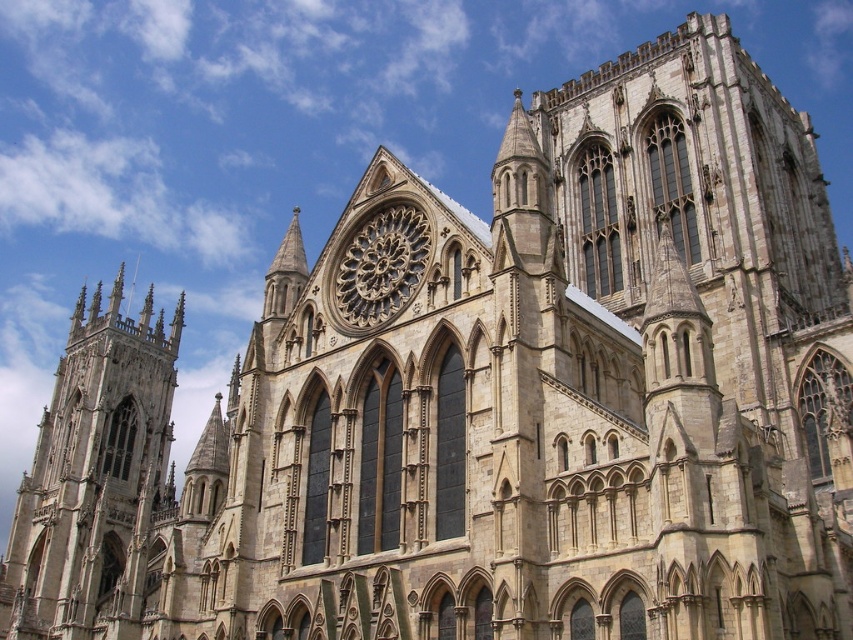
What do you see at coordinates (93, 477) in the screenshot? I see `stone gothic tower at left` at bounding box center [93, 477].

Who is more forward, (54, 445) or (375, 246)?

Point (375, 246) is in front.

Locate an element on the screen. stone gothic tower at left is located at coordinates (93, 477).